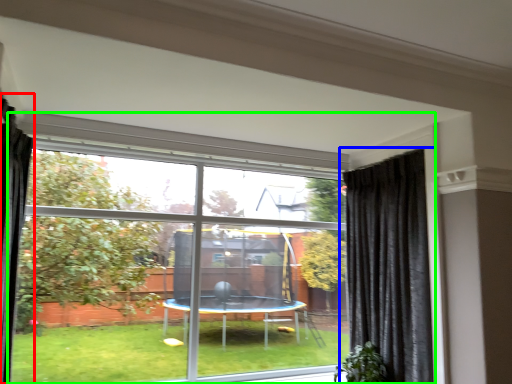
Question: Which is nearer to the curtain (highlighted by a red box)? curtain (highlighted by a blue box) or window (highlighted by a green box).

Choices:
 (A) curtain
 (B) window

Answer: (B)